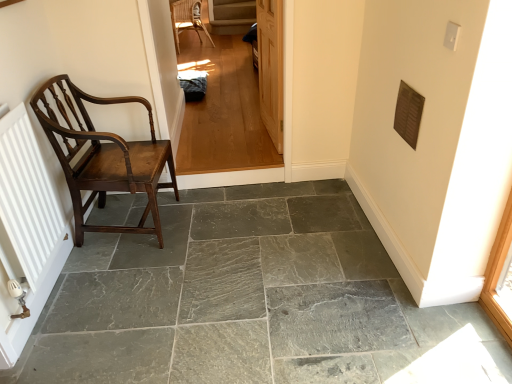
Where is `vacant area that is situated to the right of polished wood chair at left, marked as the 1th chair in a bottom-to-top arrangement`? vacant area that is situated to the right of polished wood chair at left, marked as the 1th chair in a bottom-to-top arrangement is located at coordinates (214, 222).